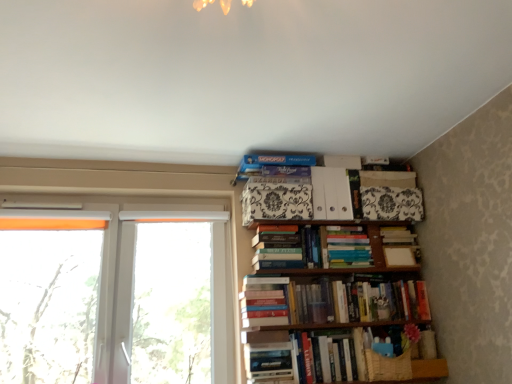
Question: In terms of size, does white matte folder at upper center, which is counted as the second paperback book, starting from the left, appear bigger or smaller than hardcover book at lower right, arranged as the 3th book when ordered from the bottom?

Choices:
 (A) small
 (B) big

Answer: (A)

Question: Is white matte folder at upper center, positioned as the 2th paperback book in right-to-left order, to the left or to the right of hardcover book at lower right, arranged as the 3th book when ordered from the bottom, in the image?

Choices:
 (A) left
 (B) right

Answer: (A)

Question: Considering the real-world distances, which object is farthest from the hardcover books at center, marked as the eighth book in a bottom-to-top arrangement?

Choices:
 (A) hardcover book at lower center, the 2th book ordered from the bottom
 (B) transparent plastic window at left, arranged as the 1th window when viewed from the right
 (C) hardcover book at center, which is counted as the 1th book, starting from the bottom
 (D) translucent plastic window at left, arranged as the first window when viewed from the left
 (E) black and white patterned box at upper center, placed as the third paperback book when sorted from right to left

Answer: (D)

Question: Which object is the farthest from the hardcover book at lower right, arranged as the 3th book when ordered from the bottom?

Choices:
 (A) translucent plastic window at left, placed as the 3th window when sorted from right to left
 (B) hardcover books at center, which ranks as the fifth book in top-to-bottom order
 (C) white plastic window at left, arranged as the 2th window when viewed from the left
 (D) hardcover book at center, the 9th book positioned from the top
 (E) hardcover books at center, marked as the eighth book in a bottom-to-top arrangement

Answer: (A)